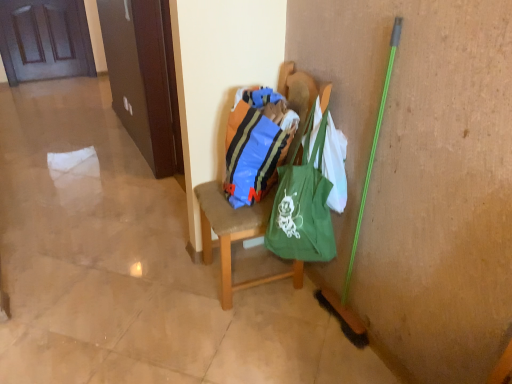
Where is `vacant location below wooden chair at center (from a real-world perspective)`? Image resolution: width=512 pixels, height=384 pixels. vacant location below wooden chair at center (from a real-world perspective) is located at coordinates (256, 272).